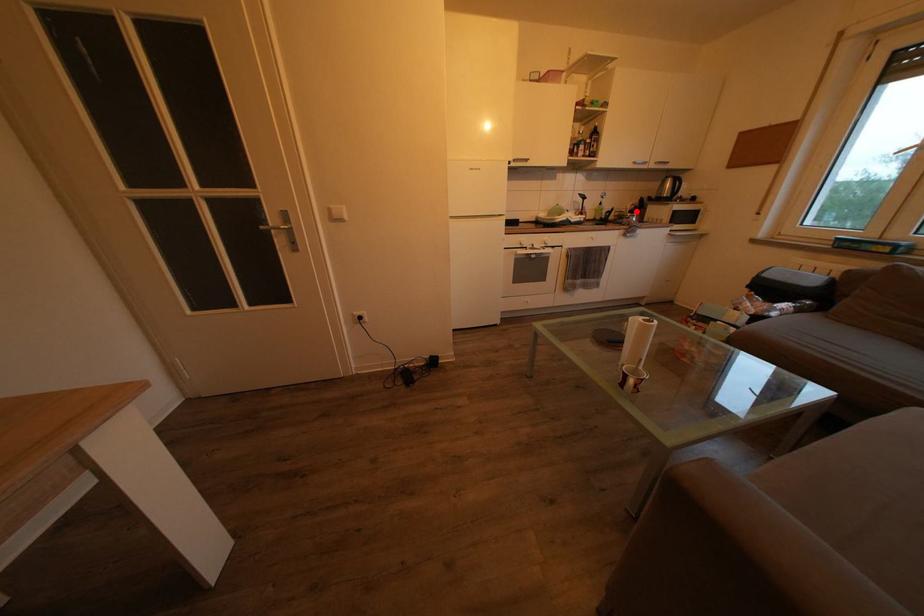
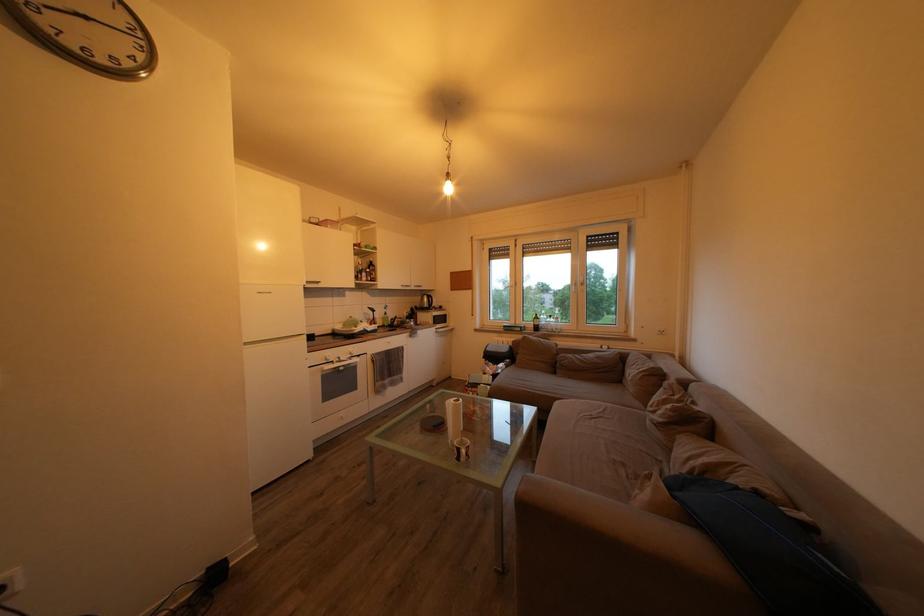
Question: I am providing you with two images of the same scene from different viewpoints. Image1 has a red point marked. In image2, the corresponding 3D location appears at what relative position? Reply with the corresponding letter.

Choices:
 (A) Closer
 (B) Farther

Answer: (B)